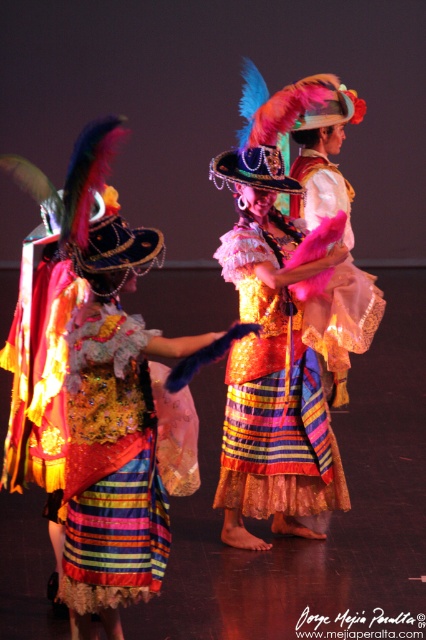
Is point (58, 209) closer to viewer compared to point (371, 285)?

Yes, point (58, 209) is in front of point (371, 285).

Image resolution: width=426 pixels, height=640 pixels. I want to click on shiny sequined dress at center, so point(94,387).

Is point (115, 468) more distant than point (279, 404)?

No, it is in front of (279, 404).

This screenshot has height=640, width=426. Identify the location of shiny sequined dress at center. (94, 387).

Does shiny sequined skirt at center have a greater width compared to shiny pink fabric at center?

Yes, shiny sequined skirt at center is wider than shiny pink fabric at center.

Which is behind, point (262, 362) or point (328, 179)?

Positioned behind is point (328, 179).

Which is behind, point (259, 323) or point (359, 320)?

The point (259, 323) is behind.

Where is `shiny sequined skirt at center`? This screenshot has height=640, width=426. shiny sequined skirt at center is located at coordinates [273, 396].